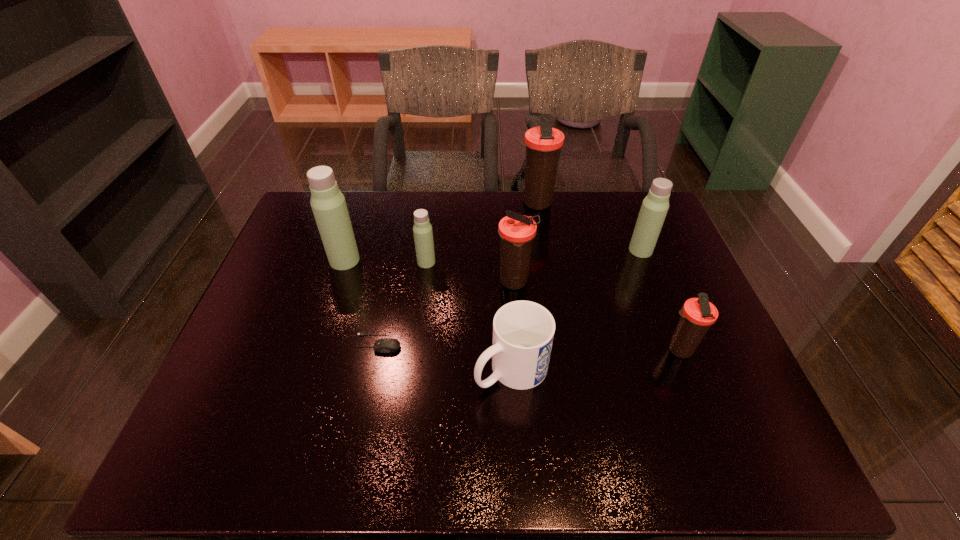
Identify the location of the farthest object. (543, 144).

The image size is (960, 540). I want to click on the farthest brown thermos bottle, so [543, 144].

The image size is (960, 540). What are the coordinates of `the leftmost object` in the screenshot? It's located at (328, 204).

This screenshot has height=540, width=960. What are the coordinates of `the leftmost light thermos bottle` in the screenshot? It's located at (328, 204).

Locate an element on the screen. the second nearest brown thermos bottle is located at coordinates (517, 231).

You are a GUI agent. You are given a task and a screenshot of the screen. Output one action in this format:
    pyautogui.click(x=<x>, y=<y>)
    Task: Click on the rightmost light thermos bottle
    This screenshot has width=960, height=540.
    Given the screenshot: What is the action you would take?
    pyautogui.click(x=655, y=205)

In order to click on the second light thermos bottle from right to left in this screenshot , I will do `click(423, 235)`.

At what (x,y) coordinates should I click in order to perform the action: click on the second thermos bottle from left to right. Please return your answer as a coordinate pair (x, y). Looking at the image, I should click on (423, 235).

The width and height of the screenshot is (960, 540). In order to click on the rightmost brown thermos bottle in this screenshot , I will do `click(697, 314)`.

Locate an element on the screen. This screenshot has height=540, width=960. the nearest brown thermos bottle is located at coordinates (697, 314).